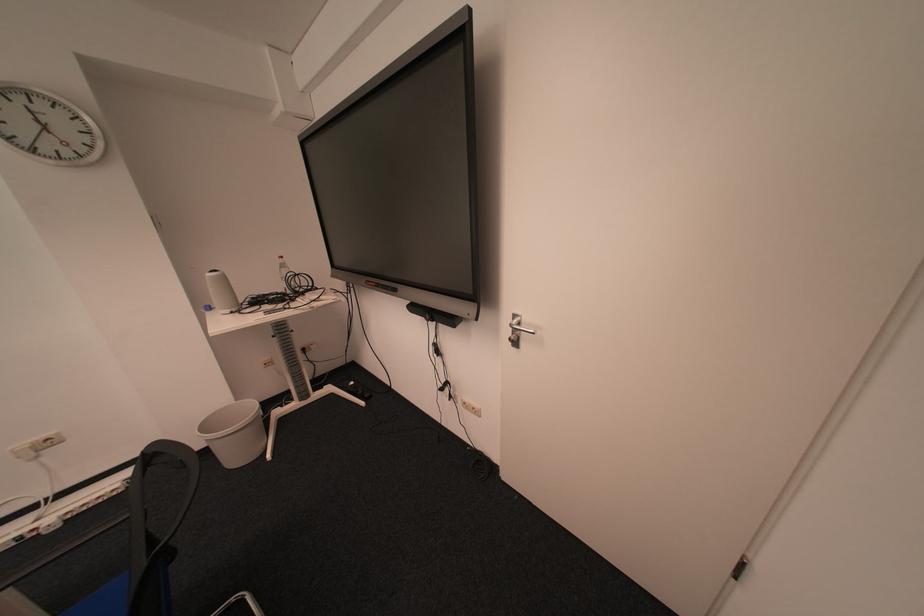
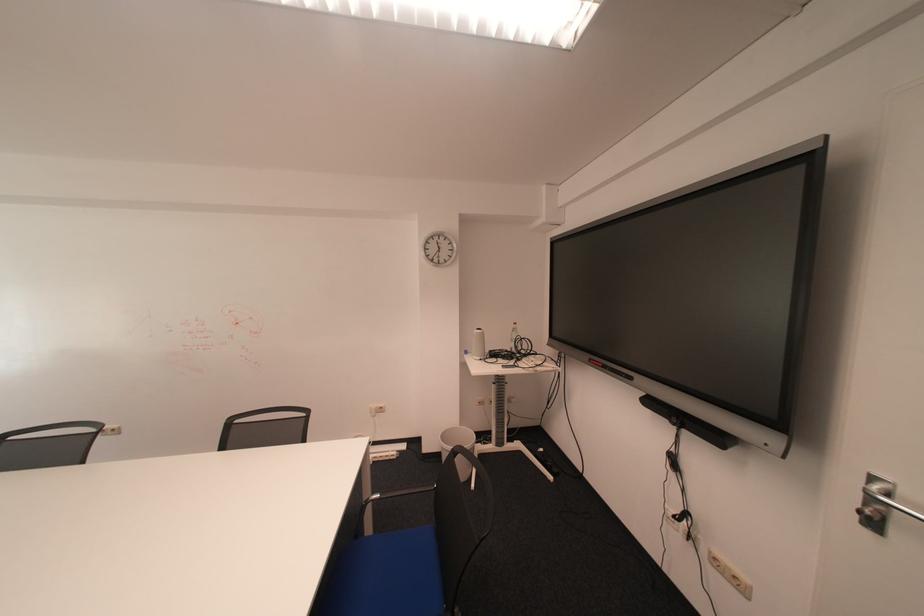
The point at (216,426) is marked in the first image. Where is the corresponding point in the second image?

(456, 437)